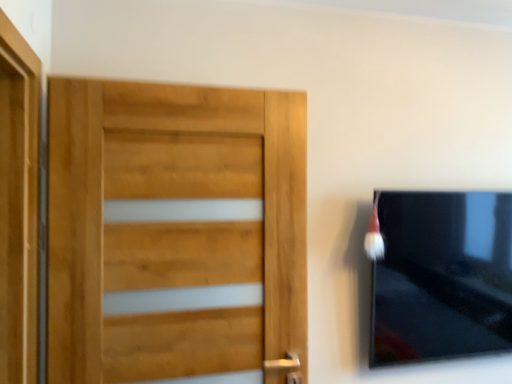
Question: Is white fluffy brush at upper right to the right of light brown wood door at left from the viewer's perspective?

Choices:
 (A) yes
 (B) no

Answer: (A)

Question: Can light brown wood door at left be found inside white fluffy brush at upper right?

Choices:
 (A) no
 (B) yes

Answer: (A)

Question: Does white fluffy brush at upper right touch light brown wood door at left?

Choices:
 (A) no
 (B) yes

Answer: (A)

Question: Is white fluffy brush at upper right to the left of light brown wood door at left from the viewer's perspective?

Choices:
 (A) yes
 (B) no

Answer: (B)

Question: From the image's perspective, is white fluffy brush at upper right beneath light brown wood door at left?

Choices:
 (A) yes
 (B) no

Answer: (B)

Question: Is light brown wood door at left taller or shorter than white fluffy brush at upper right?

Choices:
 (A) tall
 (B) short

Answer: (A)

Question: From a real-world perspective, is light brown wood door at left physically located above or below white fluffy brush at upper right?

Choices:
 (A) above
 (B) below

Answer: (B)

Question: Is light brown wood door at left inside the boundaries of white fluffy brush at upper right, or outside?

Choices:
 (A) outside
 (B) inside

Answer: (A)

Question: Looking at their shapes, would you say light brown wood door at left is wider or thinner than white fluffy brush at upper right?

Choices:
 (A) wide
 (B) thin

Answer: (B)

Question: From their relative heights in the image, would you say matte black tv at right is taller or shorter than light brown wood door at left?

Choices:
 (A) tall
 (B) short

Answer: (B)

Question: From the image's perspective, is matte black tv at right positioned above or below light brown wood door at left?

Choices:
 (A) above
 (B) below

Answer: (B)

Question: Is point (460, 223) closer or farther from the camera than point (142, 302)?

Choices:
 (A) farther
 (B) closer

Answer: (A)

Question: Would you say matte black tv at right is inside or outside light brown wood door at left?

Choices:
 (A) outside
 (B) inside

Answer: (A)

Question: Considering the positions of white fluffy brush at upper right and light brown wood door at left in the image, is white fluffy brush at upper right taller or shorter than light brown wood door at left?

Choices:
 (A) tall
 (B) short

Answer: (B)

Question: Does point (375, 218) appear closer or farther from the camera than point (115, 157)?

Choices:
 (A) closer
 (B) farther

Answer: (B)